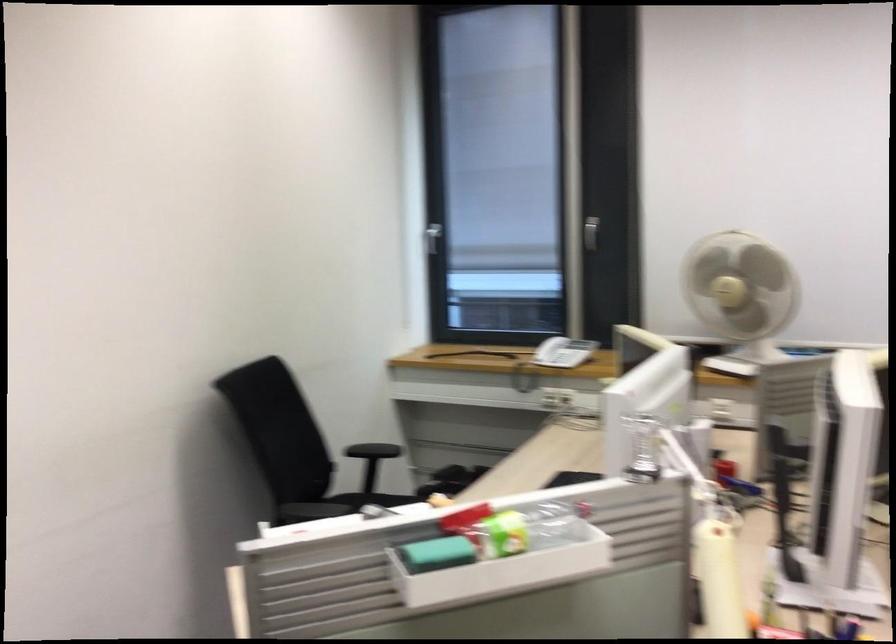
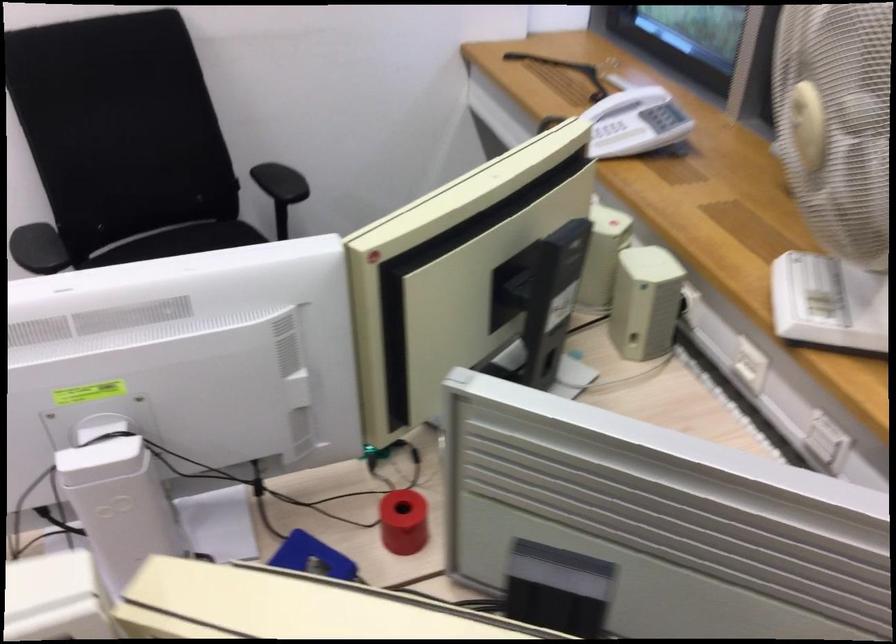
Locate, in the second image, the point that corresponds to [718,451] in the first image.

(403, 522)